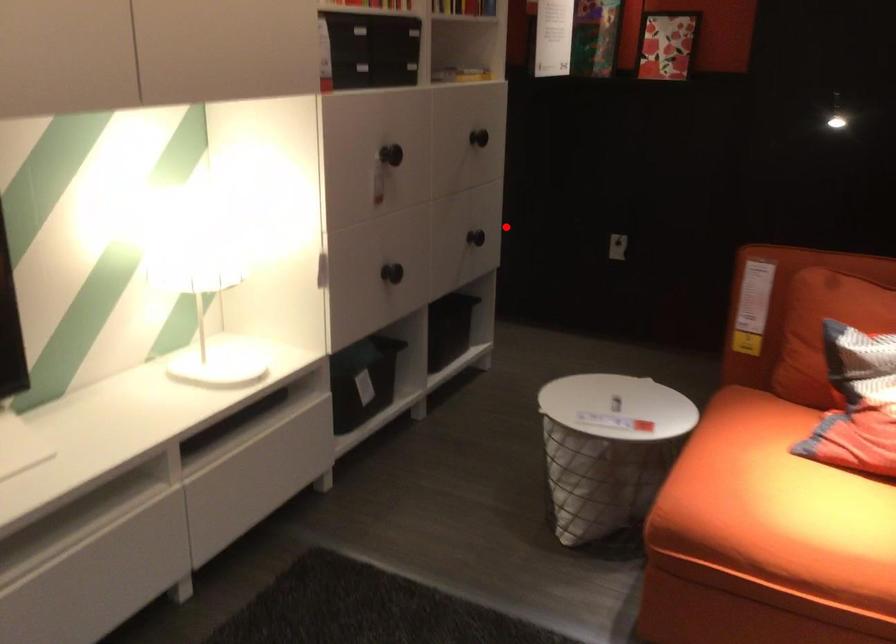
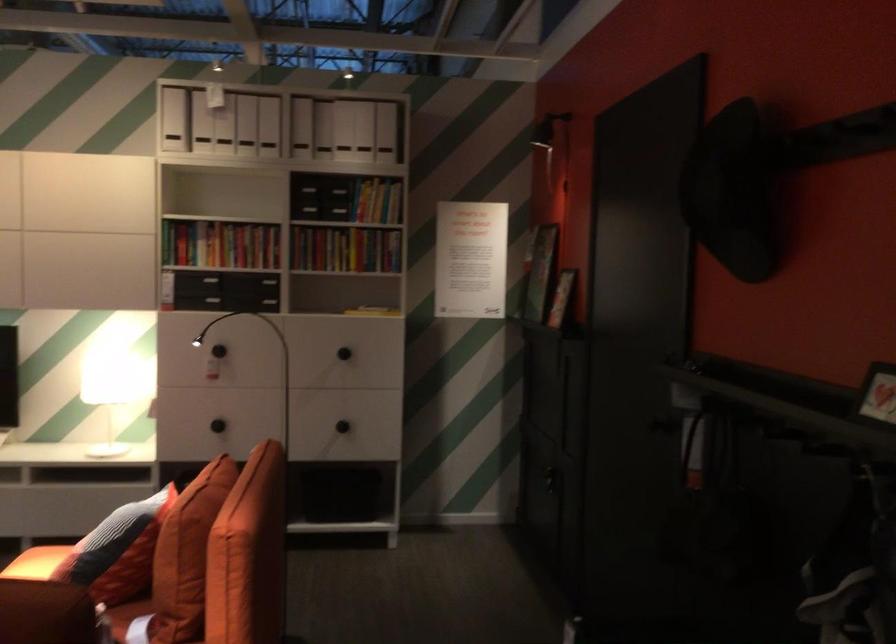
Locate, in the second image, the point that corresponds to the highlighted location in the first image.

(341, 426)